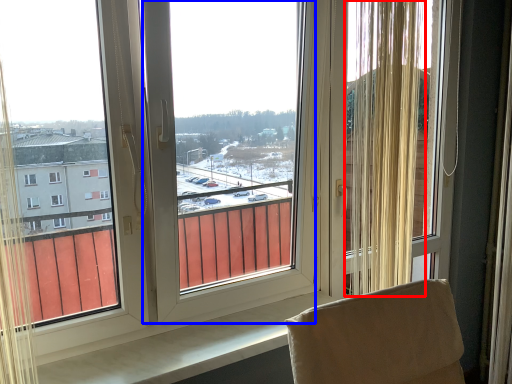
Question: Which point is further to the camera, curtain (highlighted by a red box) or window screen (highlighted by a blue box)?

Choices:
 (A) curtain
 (B) window screen

Answer: (A)